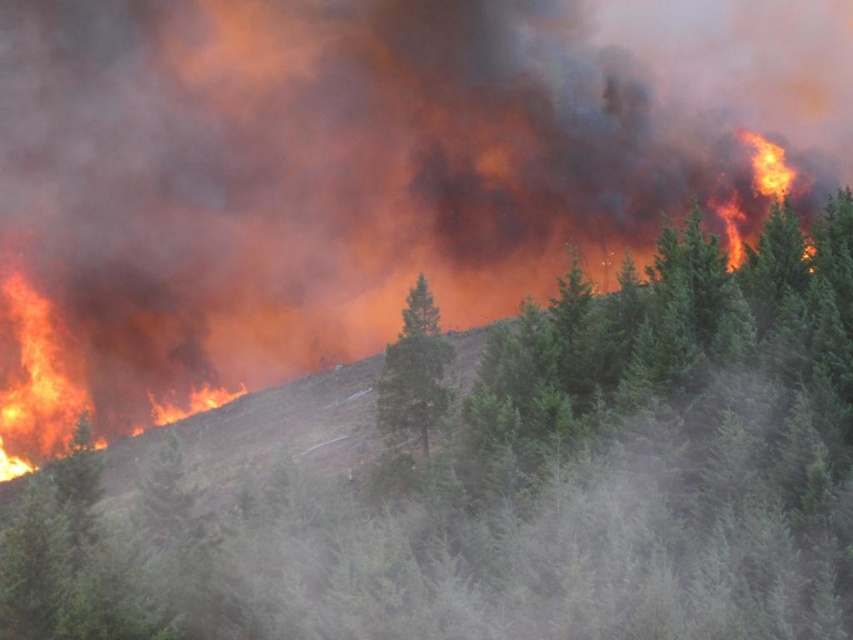
You are a firefighter trying to navigate through the wildfire area. You see a green textured tree at center. Based on its position, can you estimate how far it is from the origin point of the fire?

The green textured tree at center is located at point (498, 481), so it is approximately 0.752 meters away from the origin point of the fire.

You are a firefighter positioned at the edge of a wildfire. You see a green textured tree at center that is still unburned. If you need to reach a safe zone located 25 meters behind you, can you safely retreat without passing too close to the flames? Explain your reasoning.

The green textured tree at center is 22.13 meters away from you. Since the safe zone is 25 meters behind your current position, you can retreat safely by moving backward away from the fire without needing to approach the tree. The distance allows enough space to reach safety without risking exposure to the flames.